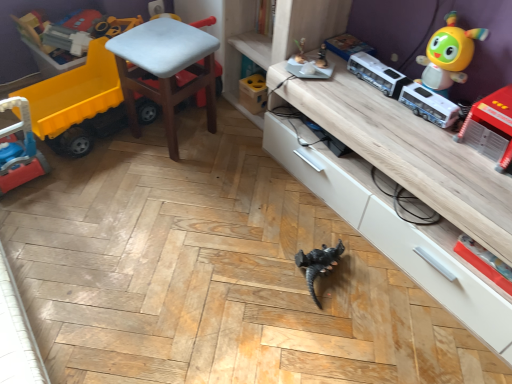
Where is `free spot in front of red plastic fire truck at right, positioned as the fifth toy in left-to-right order`? free spot in front of red plastic fire truck at right, positioned as the fifth toy in left-to-right order is located at coordinates (x=484, y=184).